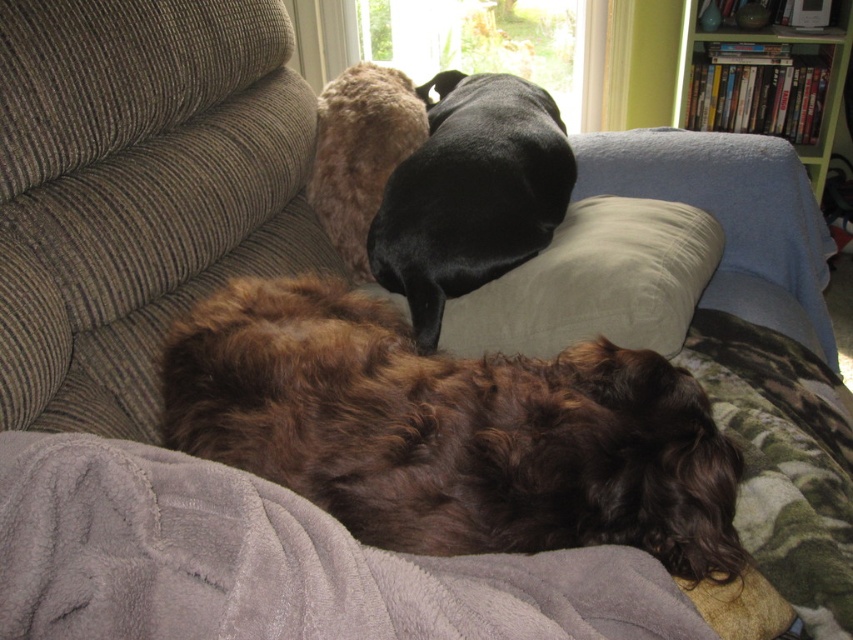
You are holding a 12 inch long measuring tape and want to measure the distance from the camera to the point at coordinates point [514,568]. Can you reach it with your tape measure?

The point at coordinates point [514,568] is 31.56 inches away from the camera. Since the measuring tape is only 12 inches long, it cannot reach that distance.

You are trying to place a new pillow on the couch where the brown fuzzy dog at lower center and the gray fleece blanket at lower left are located. Based on their sizes, will the pillow fit between them without overlapping?

The brown fuzzy dog at lower center is wider than the gray fleece blanket at lower left. Therefore, the pillow may not fit between them if the space between the two is limited by the dog taking up more width. However, without knowing the pillow size, it is hard to determine for sure.